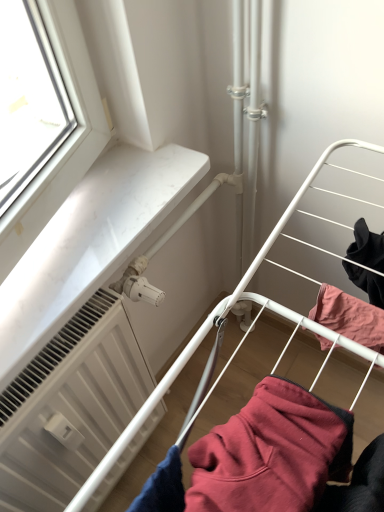
Find the location of a particular element. This screenshot has height=512, width=384. free space above maroon fleece sweatshirt at center (from a real-world perspective) is located at coordinates (278, 433).